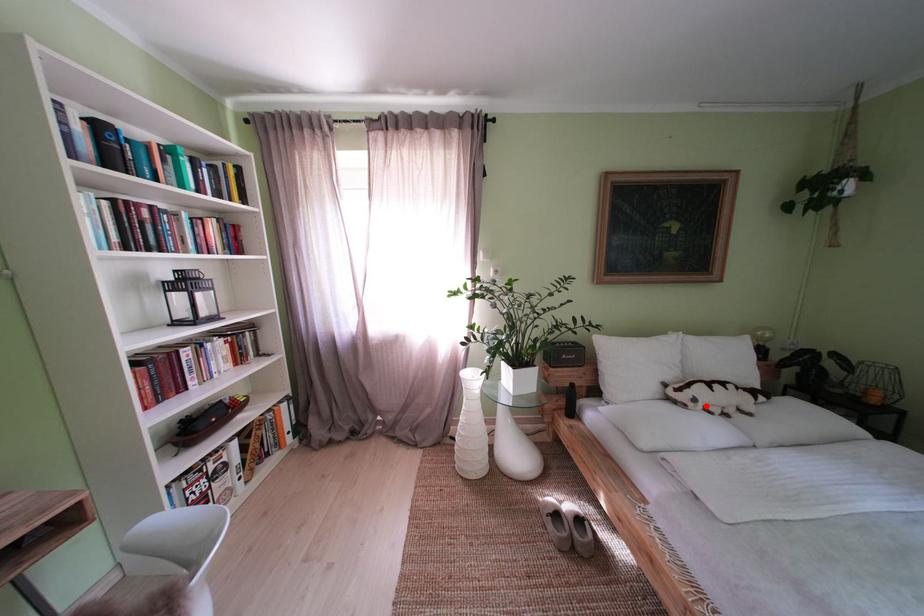
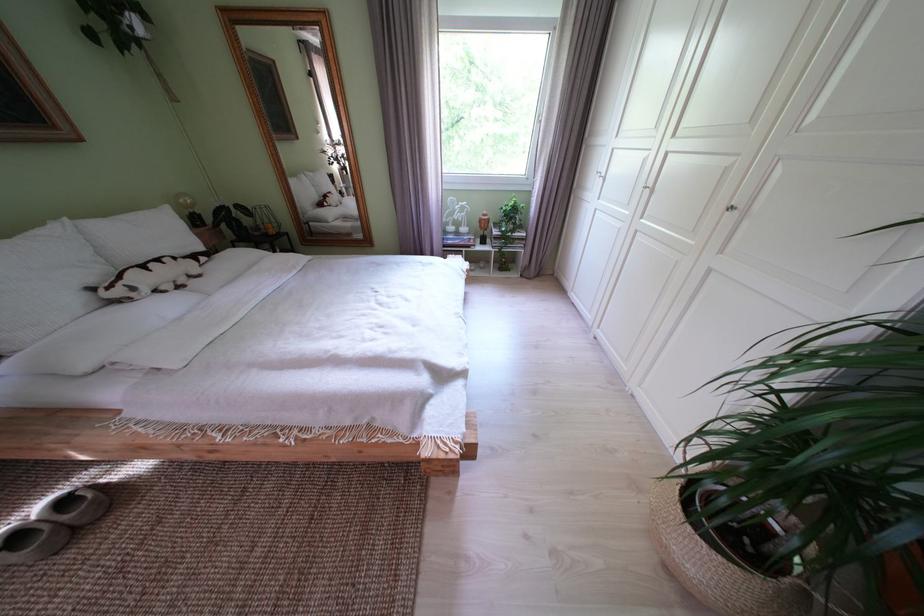
Locate, in the second image, the point that corresponds to the highlighted location in the first image.

(146, 294)